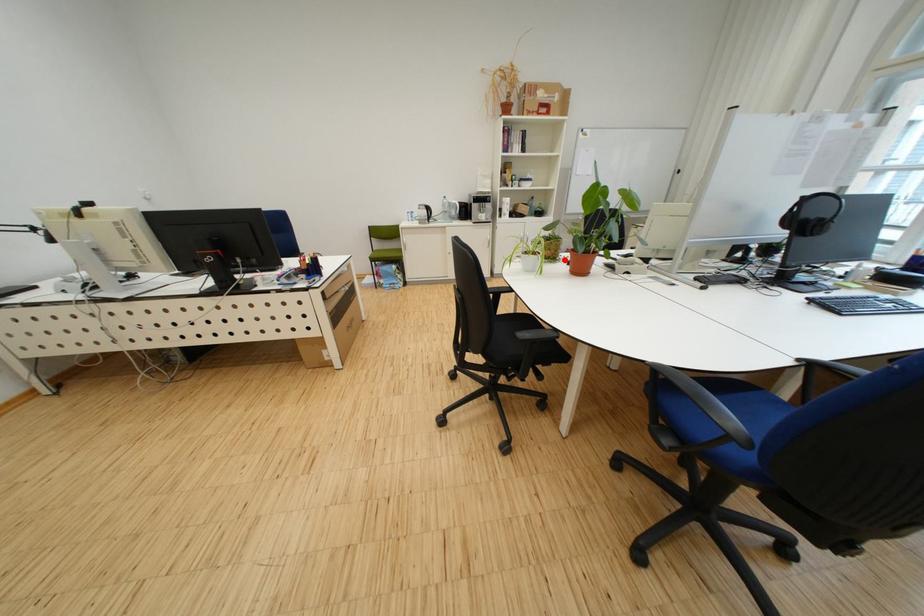
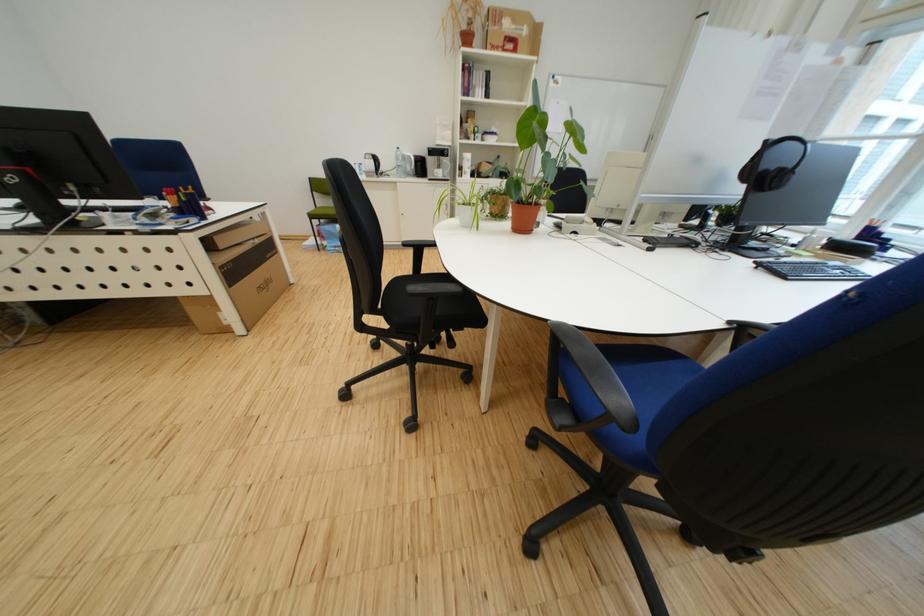
Where in the second image is the point corresponding to the highlighted location from the first image?

(509, 217)